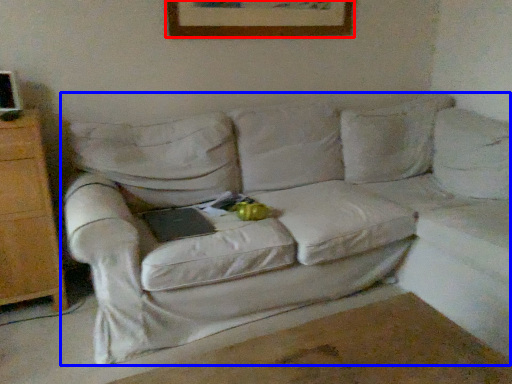
Question: Which object appears closest to the camera in this image, picture frame (highlighted by a red box) or studio couch (highlighted by a blue box)?

Choices:
 (A) picture frame
 (B) studio couch

Answer: (B)